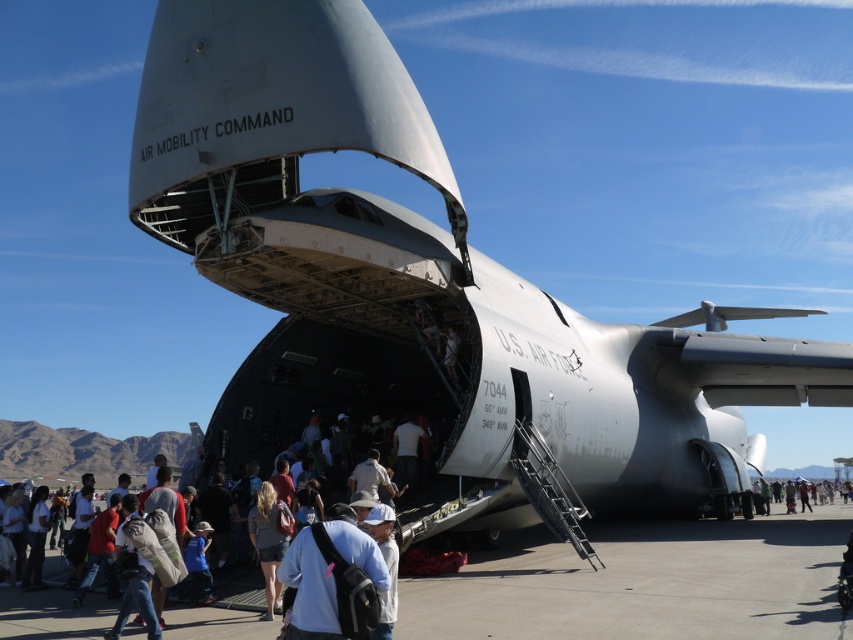
Does gray concrete tarmac at lower center have a greater height compared to light blue fabric shirt at lower center?

Yes.

Locate an element on the screen. gray concrete tarmac at lower center is located at coordinates (645, 582).

Find the location of a particular element. The width and height of the screenshot is (853, 640). gray concrete tarmac at lower center is located at coordinates 645,582.

Who is lower down, gray concrete tarmac at lower center or white fabric crowd at center?

white fabric crowd at center is below.

Is point (453, 588) more distant than point (86, 461)?

That is False.

Where is `gray concrete tarmac at lower center`? gray concrete tarmac at lower center is located at coordinates (645, 582).

Which is behind, point (21, 620) or point (822, 484)?

The point (822, 484) is more distant.

Does gray concrete tarmac at lower center have a greater height compared to white cotton shirt at lower right?

No, gray concrete tarmac at lower center is not taller than white cotton shirt at lower right.

The height and width of the screenshot is (640, 853). Identify the location of gray concrete tarmac at lower center. (645, 582).